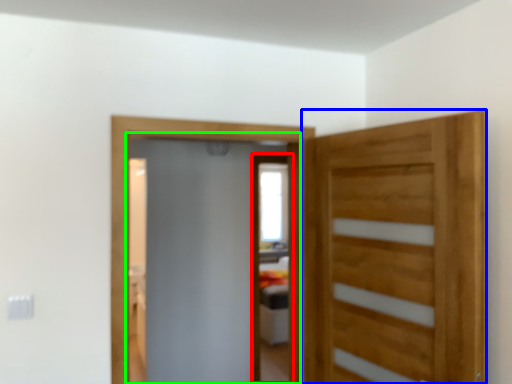
Question: Which is farther away from screen door (highlighted by a red box)? door (highlighted by a blue box) or screen door (highlighted by a green box)?

Choices:
 (A) door
 (B) screen door

Answer: (A)